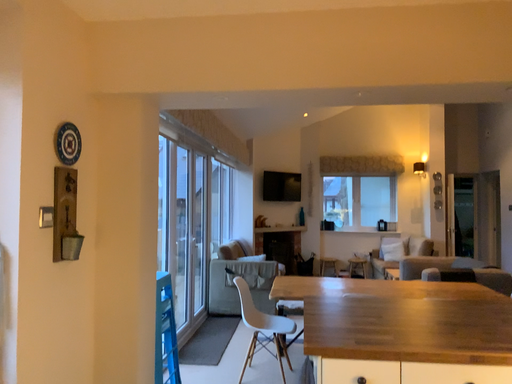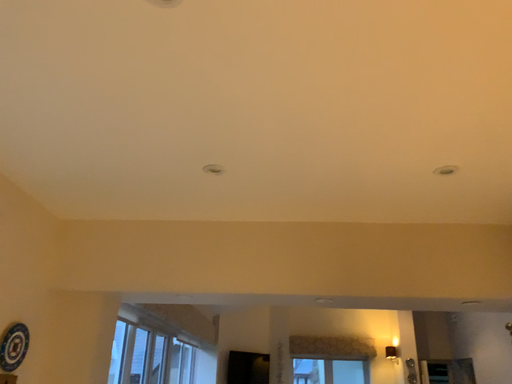
Question: Which way did the camera rotate in the video?

Choices:
 (A) rotated downward
 (B) rotated upward

Answer: (B)